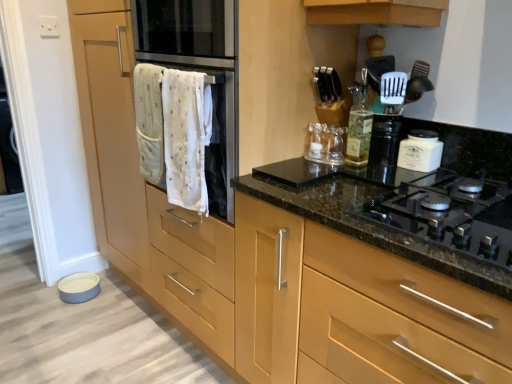
Question: Considering the relative sizes of white matte jar at upper right and white cloth oven at center in the image provided, is white matte jar at upper right shorter than white cloth oven at center?

Choices:
 (A) no
 (B) yes

Answer: (B)

Question: From a real-world perspective, is white matte jar at upper right beneath white cloth oven at center?

Choices:
 (A) no
 (B) yes

Answer: (B)

Question: Is white cloth oven at center surrounded by white matte jar at upper right?

Choices:
 (A) no
 (B) yes

Answer: (A)

Question: Is white matte jar at upper right facing away from white cloth oven at center?

Choices:
 (A) yes
 (B) no

Answer: (B)

Question: From the image's perspective, is white matte jar at upper right under white cloth oven at center?

Choices:
 (A) no
 (B) yes

Answer: (B)

Question: Is white matte jar at upper right smaller than white cloth oven at center?

Choices:
 (A) yes
 (B) no

Answer: (A)

Question: Can you see matte wood cabinet at center touching black glass gas stove at center right?

Choices:
 (A) no
 (B) yes

Answer: (A)

Question: Considering the relative positions of matte wood cabinet at center and black glass gas stove at center right in the image provided, is matte wood cabinet at center behind black glass gas stove at center right?

Choices:
 (A) yes
 (B) no

Answer: (B)

Question: Is matte wood cabinet at center completely or partially outside of black glass gas stove at center right?

Choices:
 (A) yes
 (B) no

Answer: (A)

Question: Is matte wood cabinet at center positioned before black glass gas stove at center right?

Choices:
 (A) yes
 (B) no

Answer: (A)

Question: From the image's perspective, is matte wood cabinet at center located above black glass gas stove at center right?

Choices:
 (A) yes
 (B) no

Answer: (B)

Question: Considering the relative sizes of matte wood cabinet at center and black glass gas stove at center right in the image provided, is matte wood cabinet at center smaller than black glass gas stove at center right?

Choices:
 (A) yes
 (B) no

Answer: (B)

Question: Considering the relative positions of white plastic spatula at upper right and translucent glass bottle at upper center in the image provided, is white plastic spatula at upper right to the left of translucent glass bottle at upper center from the viewer's perspective?

Choices:
 (A) yes
 (B) no

Answer: (B)